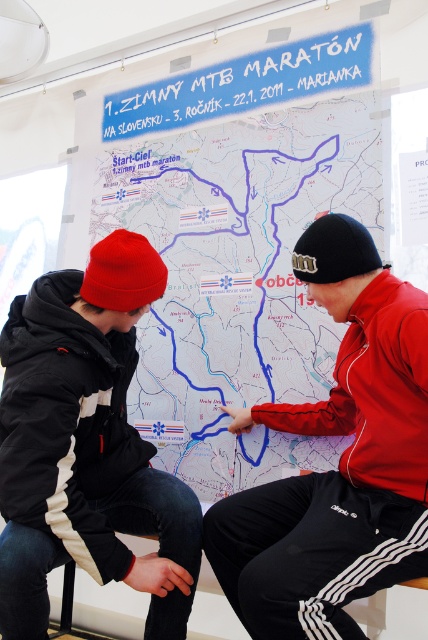
Question: Which object is positioned farthest from the red fleece jacket at center?

Choices:
 (A) black matte jacket at left
 (B) matte paper map at center

Answer: (B)

Question: Does matte paper map at center come behind red fleece jacket at center?

Choices:
 (A) no
 (B) yes

Answer: (B)

Question: In this image, where is red fleece jacket at center located relative to black matte jacket at left?

Choices:
 (A) right
 (B) left

Answer: (A)

Question: Is matte paper map at center to the right of black matte jacket at left from the viewer's perspective?

Choices:
 (A) no
 (B) yes

Answer: (B)

Question: Which object appears farthest from the camera in this image?

Choices:
 (A) black matte jacket at left
 (B) red fleece jacket at center
 (C) matte paper map at center

Answer: (C)

Question: Which of the following is the closest to the observer?

Choices:
 (A) (353, 502)
 (B) (350, 115)
 (C) (88, 483)

Answer: (A)